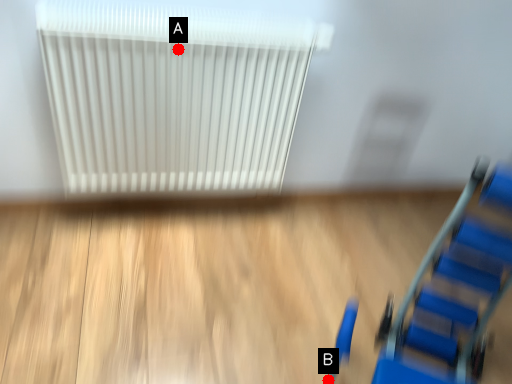
Question: Two points are circled on the image, labeled by A and B beside each circle. Among these points, which one is farthest from the camera?

Choices:
 (A) A is further
 (B) B is further

Answer: (A)